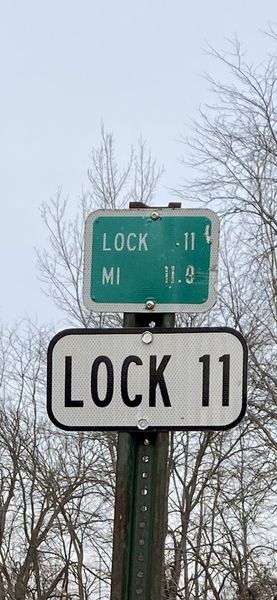
Identify the location of screws. (156, 214), (149, 304), (149, 337), (141, 426).